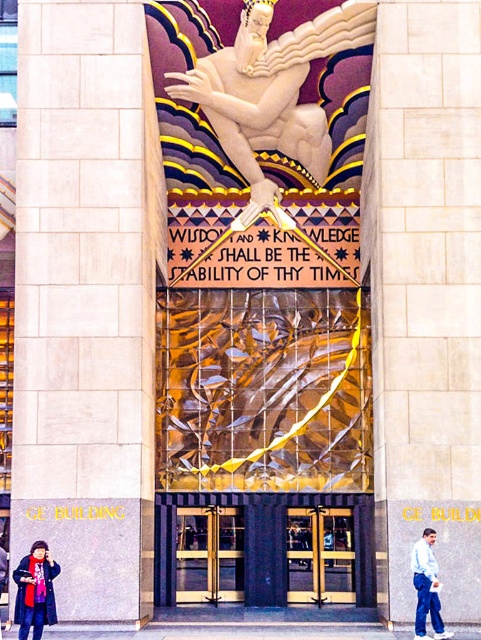
Question: Which point is closer to the camera?

Choices:
 (A) beige stone pillar at left
 (B) polished brass doors at center
 (C) white marble statue at upper center
 (D) gold metallic doors at center

Answer: (A)

Question: Which is nearer to the white marble statue at upper center?

Choices:
 (A) gold polished metal doors at center
 (B) gold metallic doors at center
 (C) beige stone pillar at left
 (D) polished brass doors at center

Answer: (C)

Question: Which is nearer to the beige stone pillar at left?

Choices:
 (A) matte black coat at lower left
 (B) gold metallic doors at center

Answer: (A)

Question: Can you confirm if white marble statue at upper center is positioned below polished brass doors at center?

Choices:
 (A) yes
 (B) no

Answer: (B)

Question: Does white marble statue at upper center appear on the left side of light blue jeans at lower right?

Choices:
 (A) no
 (B) yes

Answer: (B)

Question: Is polished brass doors at center positioned behind light blue jeans at lower right?

Choices:
 (A) no
 (B) yes

Answer: (B)